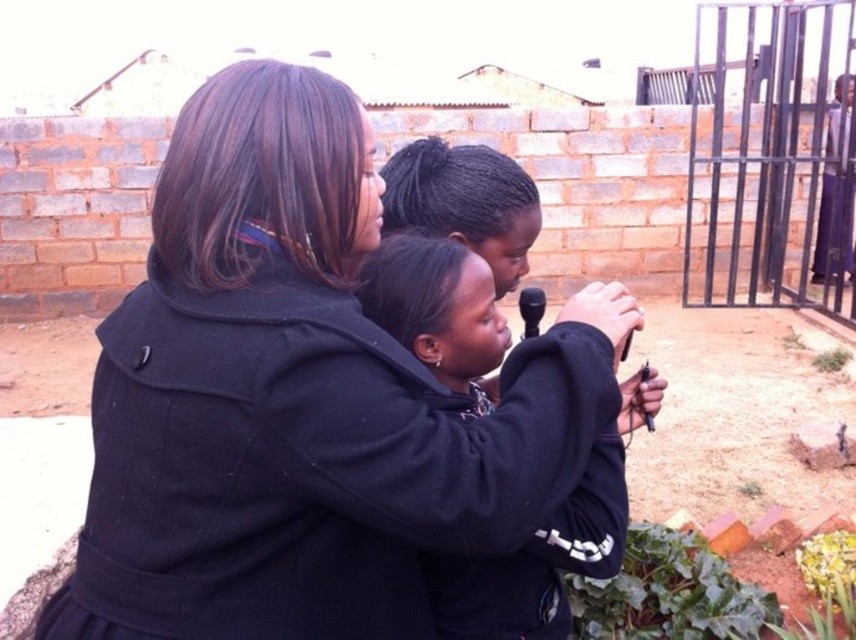
Can you confirm if black wool coat at center is bigger than dark blue hoodie at center?

Indeed, black wool coat at center has a larger size compared to dark blue hoodie at center.

Who is higher up, black wool coat at center or dark blue hoodie at center?

black wool coat at center is above.

Which is in front, point (110, 481) or point (421, 250)?

Point (110, 481)

Image resolution: width=856 pixels, height=640 pixels. Find the location of `black wool coat at center`. black wool coat at center is located at coordinates (299, 400).

Between dark blue hoodie at center and purple fabric pants at right, which one has more height?

Standing taller between the two is purple fabric pants at right.

Image resolution: width=856 pixels, height=640 pixels. Describe the element at coordinates (538, 561) in the screenshot. I see `dark blue hoodie at center` at that location.

Is point (554, 525) positioned after point (836, 90)?

No, it is in front of (836, 90).

Where is `dark blue hoodie at center`? Image resolution: width=856 pixels, height=640 pixels. dark blue hoodie at center is located at coordinates (538, 561).

Is metallic gate at right further to camera compared to purple fabric pants at right?

That is False.

Which is above, metallic gate at right or purple fabric pants at right?

metallic gate at right

What do you see at coordinates (770, 157) in the screenshot? Image resolution: width=856 pixels, height=640 pixels. I see `metallic gate at right` at bounding box center [770, 157].

Locate an element on the screen. The width and height of the screenshot is (856, 640). metallic gate at right is located at coordinates (770, 157).